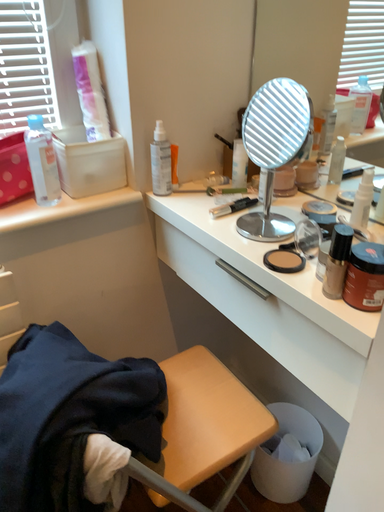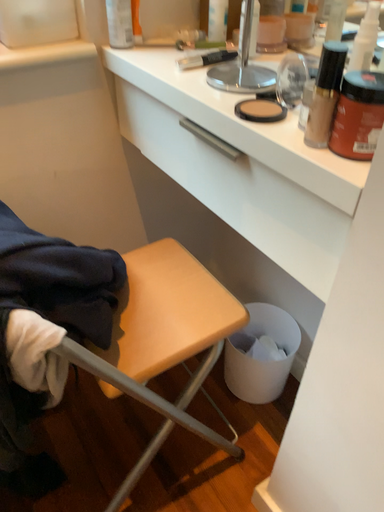
Question: Which way did the camera rotate in the video?

Choices:
 (A) rotated downward
 (B) rotated upward

Answer: (A)